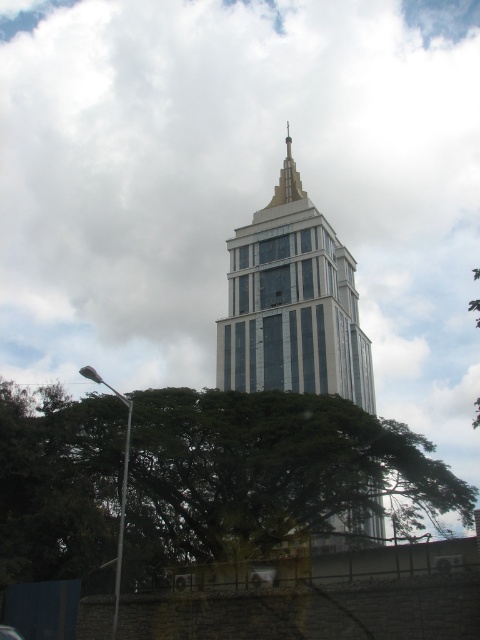
Is green leafy tree at lower left positioned in front of metallic glass tower at center?

Yes.

Find the location of a particular element. green leafy tree at lower left is located at coordinates (264, 474).

Between white fluffy cloud at upper center and shiny gold spire at center, which one is positioned higher?

Positioned higher is white fluffy cloud at upper center.

Who is positioned more to the right, white fluffy cloud at upper center or shiny gold spire at center?

shiny gold spire at center is more to the right.

Who is more forward, [149,246] or [288,150]?

Positioned in front is point [288,150].

The height and width of the screenshot is (640, 480). I want to click on white fluffy cloud at upper center, so click(x=237, y=180).

Between white fluffy cloud at upper center and metallic glass tower at center, which one is positioned higher?

white fluffy cloud at upper center

Between white fluffy cloud at upper center and metallic glass tower at center, which one is positioned lower?

Positioned lower is metallic glass tower at center.

Is point (165, 211) more distant than point (359, 388)?

Yes, it is.

Locate an element on the screen. The image size is (480, 640). white fluffy cloud at upper center is located at coordinates (237, 180).